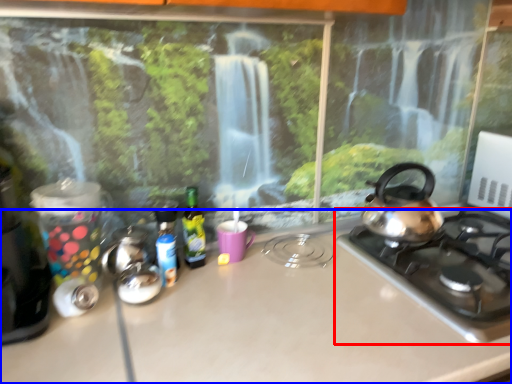
Question: Among these objects, which one is farthest to the camera, gas stove (highlighted by a red box) or countertop (highlighted by a blue box)?

Choices:
 (A) gas stove
 (B) countertop

Answer: (A)